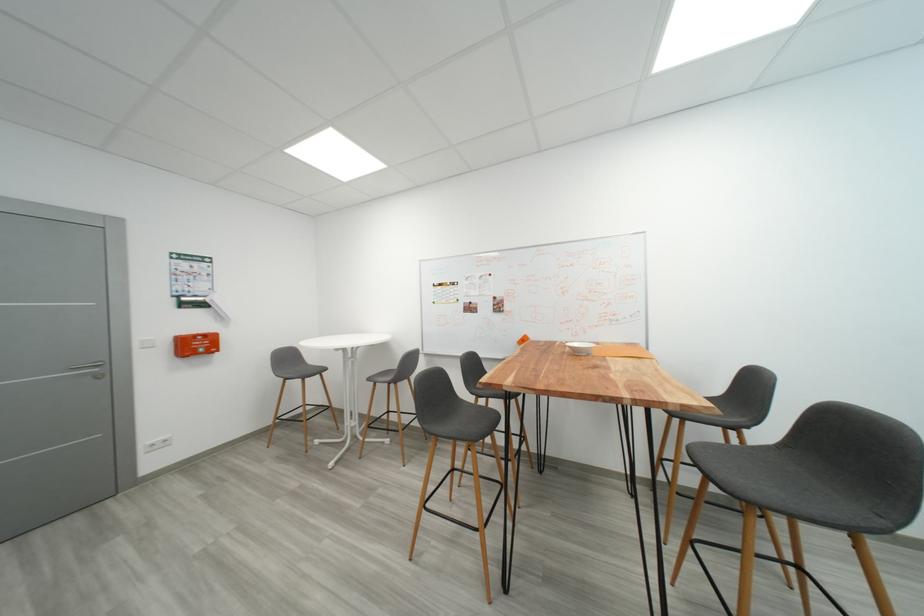
The height and width of the screenshot is (616, 924). Describe the element at coordinates (91, 369) in the screenshot. I see `the silver door handle` at that location.